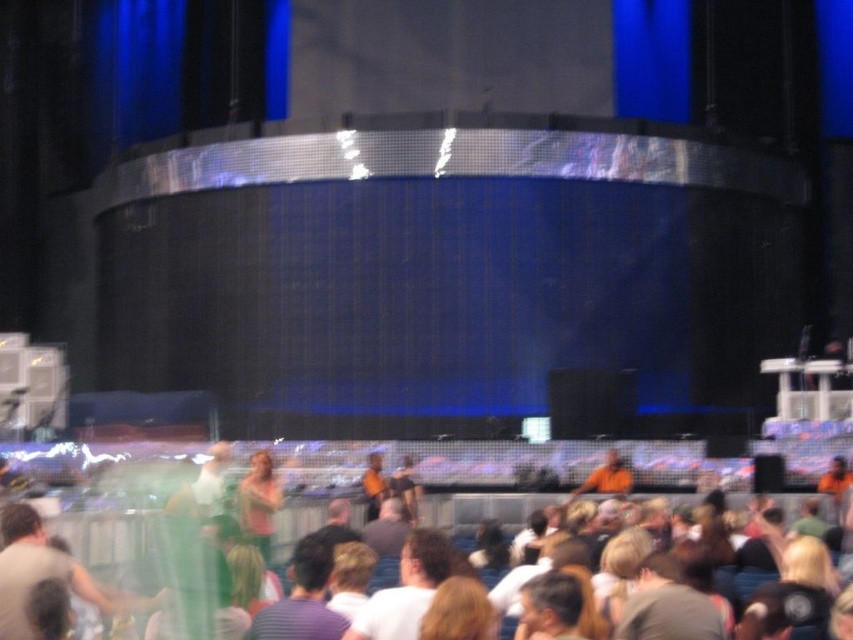
Between white cotton t-shirts at center and striped cotton shirt at center, which one is positioned lower?

white cotton t-shirts at center is lower down.

Between point (424, 515) and point (321, 595), which one is positioned behind?

The point (424, 515) is more distant.

The width and height of the screenshot is (853, 640). Identify the location of white cotton t-shirts at center. (431, 480).

Where is `white cotton t-shirts at center`? white cotton t-shirts at center is located at coordinates (431, 480).

Between white cotton t-shirts at center and white t-shirt at center, which one is positioned lower?

white cotton t-shirts at center is below.

Describe the element at coordinates (431, 480) in the screenshot. The image size is (853, 640). I see `white cotton t-shirts at center` at that location.

Describe the element at coordinates (431, 480) in the screenshot. This screenshot has width=853, height=640. I see `white cotton t-shirts at center` at that location.

The width and height of the screenshot is (853, 640). Find the location of `white cotton t-shirts at center`. white cotton t-shirts at center is located at coordinates (431, 480).

Who is shorter, dark gray shirt at lower center or green fabric dress at center?

dark gray shirt at lower center is shorter.

Image resolution: width=853 pixels, height=640 pixels. What do you see at coordinates (666, 605) in the screenshot?
I see `dark gray shirt at lower center` at bounding box center [666, 605].

I want to click on dark gray shirt at lower center, so click(x=666, y=605).